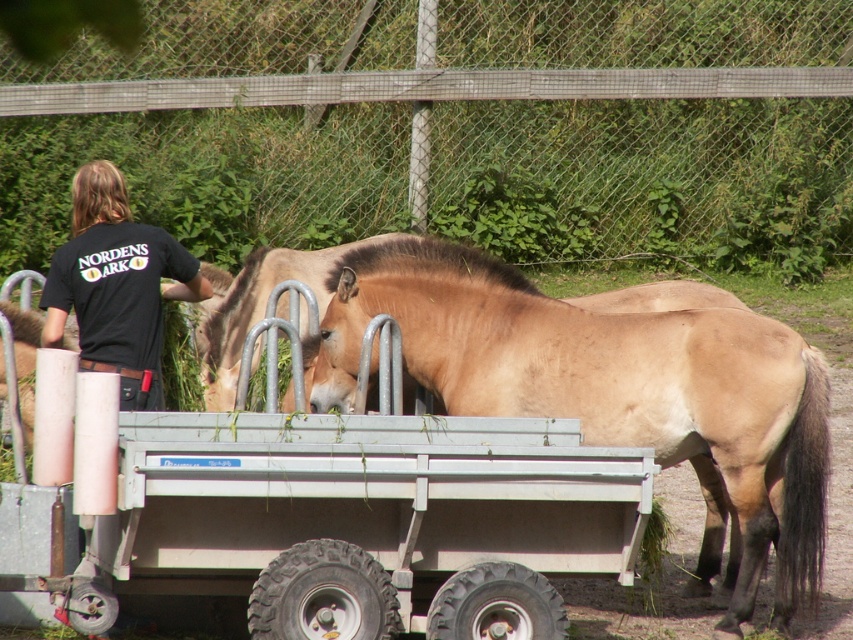
Question: Does metallic silver wagon at center have a larger size compared to brown matte horse at center?

Choices:
 (A) yes
 (B) no

Answer: (A)

Question: Based on their relative distances, which object is farther from the light brown fur at center?

Choices:
 (A) metallic silver wagon at center
 (B) metal mesh fence at upper center
 (C) black cotton shirt at upper left

Answer: (B)

Question: Which of these objects is positioned closest to the metal mesh fence at upper center?

Choices:
 (A) black cotton shirt at upper left
 (B) metallic silver wagon at center
 (C) light brown fur at center
 (D) brown matte horse at center

Answer: (D)

Question: Can you confirm if light brown fur at center is positioned above brown matte horse at center?

Choices:
 (A) yes
 (B) no

Answer: (B)

Question: Is metal mesh fence at upper center closer to the viewer compared to metallic silver wagon at center?

Choices:
 (A) yes
 (B) no

Answer: (B)

Question: Based on their relative distances, which object is farther from the brown matte horse at center?

Choices:
 (A) light brown fur at center
 (B) metal mesh fence at upper center
 (C) black cotton shirt at upper left
 (D) metallic silver wagon at center

Answer: (B)